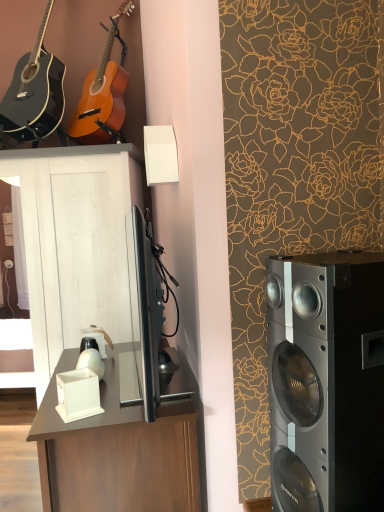
Where is `silver metallic speaker at right`? silver metallic speaker at right is located at coordinates (326, 381).

What do you see at coordinates (75, 243) in the screenshot?
I see `white wood cabinet at center` at bounding box center [75, 243].

Where is `matte brown desk at center`? The image size is (384, 512). matte brown desk at center is located at coordinates (117, 451).

From the image's perspective, is silver metallic speaker at right located above or below white wood cabinet at center?

Based on their image positions, silver metallic speaker at right is located above white wood cabinet at center.

Considering the relative sizes of silver metallic speaker at right and white wood cabinet at center in the image provided, is silver metallic speaker at right taller than white wood cabinet at center?

In fact, silver metallic speaker at right may be shorter than white wood cabinet at center.

Is silver metallic speaker at right behind white wood cabinet at center?

No, it is in front of white wood cabinet at center.

Looking at this image, how different are the orientations of orange wood guitar at upper left, the 1th guitar viewed from the right, and silver metallic speaker at right in degrees?

69.3 degrees separate the facing orientations of orange wood guitar at upper left, the 1th guitar viewed from the right, and silver metallic speaker at right.

Is silver metallic speaker at right inside orange wood guitar at upper left, the 1th guitar viewed from the right?

Definitely not — silver metallic speaker at right is not inside orange wood guitar at upper left, the 1th guitar viewed from the right.

Is orange wood guitar at upper left, the 1th guitar viewed from the right, aimed at silver metallic speaker at right?

No, orange wood guitar at upper left, the 1th guitar viewed from the right, is not facing towards silver metallic speaker at right.

Which of these two, orange wood guitar at upper left, the 1th guitar viewed from the right, or silver metallic speaker at right, is wider?

Wider between the two is orange wood guitar at upper left, the 1th guitar viewed from the right.

Is white wood cabinet at center surrounded by matte brown desk at center?

No, white wood cabinet at center is not surrounded by matte brown desk at center.

Is matte brown desk at center taller or shorter than white wood cabinet at center?

Considering their sizes, matte brown desk at center has less height than white wood cabinet at center.

Could you tell me if matte brown desk at center is facing white wood cabinet at center?

No, matte brown desk at center is not facing towards white wood cabinet at center.

From the image's perspective, relative to white wood cabinet at center, is matte brown desk at center above or below?

Clearly, from the image's perspective, matte brown desk at center is below white wood cabinet at center.

How many degrees apart are the facing directions of matte black acoustic guitar at upper left, marked as the 2th guitar in a right-to-left arrangement, and matte brown desk at center?

There is a 78.6-degree angle between the facing directions of matte black acoustic guitar at upper left, marked as the 2th guitar in a right-to-left arrangement, and matte brown desk at center.

Is matte black acoustic guitar at upper left, which is the first guitar in left-to-right order, facing towards matte brown desk at center?

No.

Is matte black acoustic guitar at upper left, marked as the 2th guitar in a right-to-left arrangement, far from matte brown desk at center?

Yes, matte black acoustic guitar at upper left, marked as the 2th guitar in a right-to-left arrangement, is far from matte brown desk at center.

Which object is wider, matte black acoustic guitar at upper left, which is the first guitar in left-to-right order, or matte brown desk at center?

matte brown desk at center is wider.

Is the surface of white wood cabinet at center in direct contact with orange wood guitar at upper left, the 1th guitar viewed from the right?

white wood cabinet at center is not next to orange wood guitar at upper left, the 1th guitar viewed from the right, and they're not touching.

Consider the image. Considering the relative sizes of white wood cabinet at center and orange wood guitar at upper left, which appears as the second guitar when viewed from the left, in the image provided, is white wood cabinet at center thinner than orange wood guitar at upper left, which appears as the second guitar when viewed from the left,?

No.

Identify the location of the 1st guitar located above the white wood cabinet at center (from a real-world perspective). (103, 93).

In the image, is white wood cabinet at center on the left side or the right side of matte black acoustic guitar at upper left, marked as the 2th guitar in a right-to-left arrangement?

In the image, white wood cabinet at center appears on the right side of matte black acoustic guitar at upper left, marked as the 2th guitar in a right-to-left arrangement.

Is white wood cabinet at center positioned with its back to matte black acoustic guitar at upper left, which is the first guitar in left-to-right order?

No.

Can you tell me how much white wood cabinet at center and matte black acoustic guitar at upper left, marked as the 2th guitar in a right-to-left arrangement, differ in facing direction?

1.27 degrees.

Is white wood cabinet at center further to camera compared to matte black acoustic guitar at upper left, marked as the 2th guitar in a right-to-left arrangement?

Yes, white wood cabinet at center is behind matte black acoustic guitar at upper left, marked as the 2th guitar in a right-to-left arrangement.

What's the angular difference between matte brown desk at center and orange wood guitar at upper left, which appears as the second guitar when viewed from the left,'s facing directions?

78.6 degrees separate the facing orientations of matte brown desk at center and orange wood guitar at upper left, which appears as the second guitar when viewed from the left.

Between matte brown desk at center and orange wood guitar at upper left, the 1th guitar viewed from the right, which one is positioned in front?

matte brown desk at center is more forward.

Is matte brown desk at center spatially inside orange wood guitar at upper left, the 1th guitar viewed from the right, or outside of it?

matte brown desk at center lies outside orange wood guitar at upper left, the 1th guitar viewed from the right.

From a real-world perspective, is matte brown desk at center positioned over orange wood guitar at upper left, the 1th guitar viewed from the right, based on gravity?

No, from a real-world perspective, matte brown desk at center is not above orange wood guitar at upper left, the 1th guitar viewed from the right.

What are the coordinates of `home appliance lying on the right of white wood cabinet at center` in the screenshot? It's located at [326, 381].

Which guitar is the 1st one when counting from the left side of the silver metallic speaker at right? Please provide its 2D coordinates.

[(103, 93)]

Which object lies nearer to the anchor point white wood cabinet at center, orange wood guitar at upper left, the 1th guitar viewed from the right, or matte brown desk at center?

orange wood guitar at upper left, the 1th guitar viewed from the right, is closer to white wood cabinet at center.

From the image, which object appears to be farther from silver metallic speaker at right, orange wood guitar at upper left, which appears as the second guitar when viewed from the left, or matte black acoustic guitar at upper left, which is the first guitar in left-to-right order?

matte black acoustic guitar at upper left, which is the first guitar in left-to-right order, is further to silver metallic speaker at right.

In the scene shown: When comparing their distances from silver metallic speaker at right, does white wood cabinet at center or matte brown desk at center seem closer?

matte brown desk at center is closer to silver metallic speaker at right.

Looking at the image, which one is located closer to silver metallic speaker at right, matte brown desk at center or white wood cabinet at center?

matte brown desk at center lies closer to silver metallic speaker at right than the other object.

Estimate the real-world distances between objects in this image. Which object is closer to white wood cabinet at center, matte black acoustic guitar at upper left, marked as the 2th guitar in a right-to-left arrangement, or matte brown desk at center?

matte black acoustic guitar at upper left, marked as the 2th guitar in a right-to-left arrangement.

Based on their spatial positions, is matte brown desk at center or white wood cabinet at center closer to matte black acoustic guitar at upper left, which is the first guitar in left-to-right order?

white wood cabinet at center is closer to matte black acoustic guitar at upper left, which is the first guitar in left-to-right order.

Looking at the image, which one is located closer to matte black acoustic guitar at upper left, which is the first guitar in left-to-right order, silver metallic speaker at right or white wood cabinet at center?

Based on the image, white wood cabinet at center appears to be nearer to matte black acoustic guitar at upper left, which is the first guitar in left-to-right order.

Based on their spatial positions, is white wood cabinet at center or matte black acoustic guitar at upper left, which is the first guitar in left-to-right order, closer to silver metallic speaker at right?

The object closer to silver metallic speaker at right is white wood cabinet at center.

Identify the location of guitar between orange wood guitar at upper left, the 1th guitar viewed from the right, and matte brown desk at center vertically. This screenshot has width=384, height=512. point(34,92).

Image resolution: width=384 pixels, height=512 pixels. What are the coordinates of `cabinetry between orange wood guitar at upper left, the 1th guitar viewed from the right, and matte brown desk at center vertically` in the screenshot? It's located at (75, 243).

Where is `home appliance between matte black acoustic guitar at upper left, which is the first guitar in left-to-right order, and matte brown desk at center vertically`? home appliance between matte black acoustic guitar at upper left, which is the first guitar in left-to-right order, and matte brown desk at center vertically is located at coordinates (326, 381).

Where is `desk between white wood cabinet at center and silver metallic speaker at right in the horizontal direction`? The width and height of the screenshot is (384, 512). desk between white wood cabinet at center and silver metallic speaker at right in the horizontal direction is located at coordinates (117, 451).